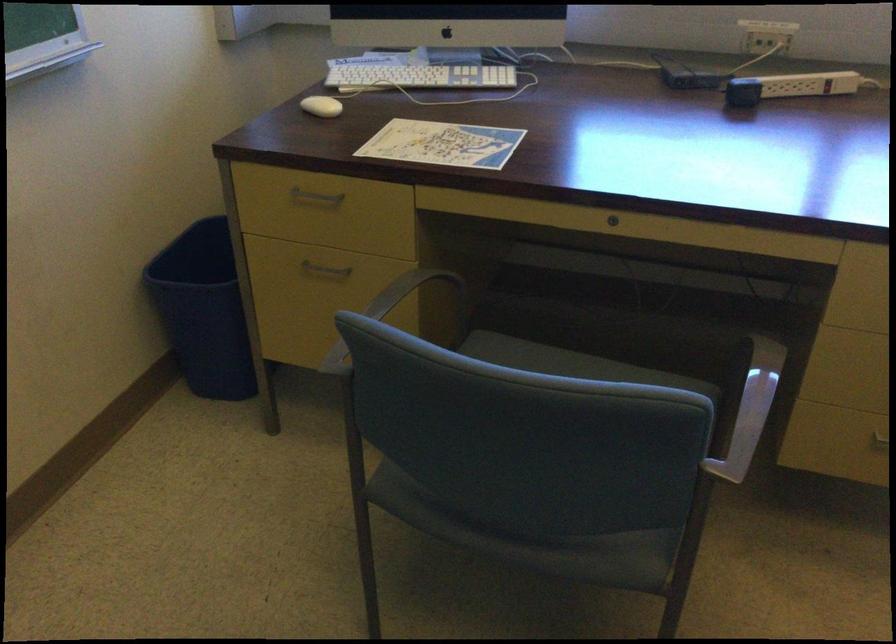
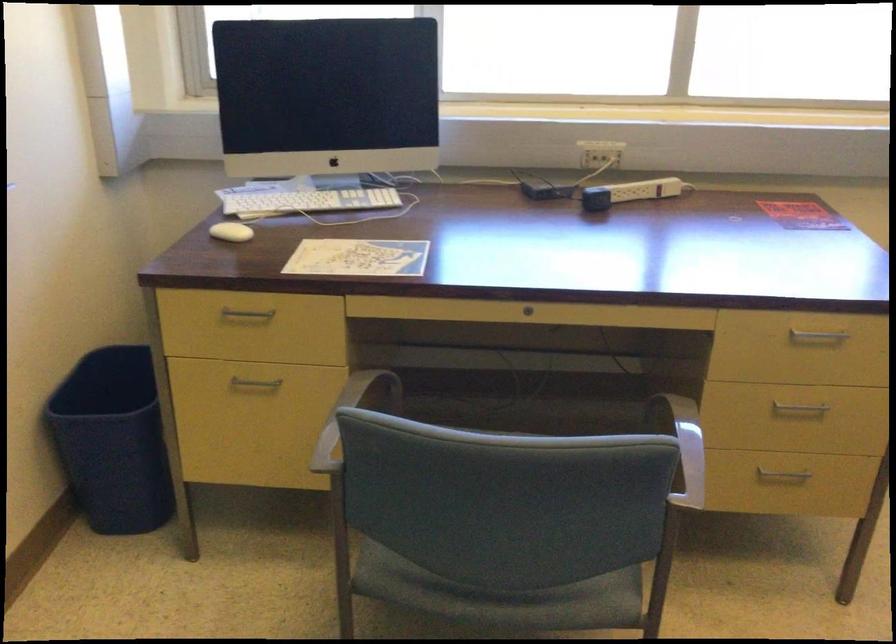
Find the pixel in the second image that matches (409,75) in the first image.

(304, 200)